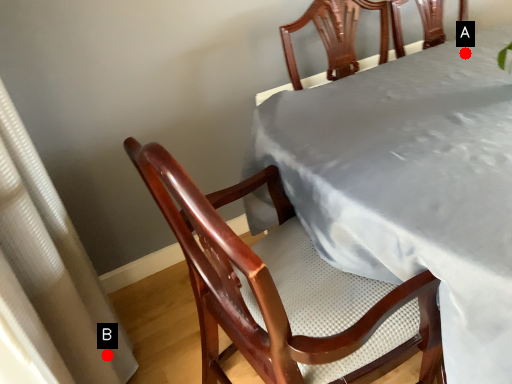
Question: Two points are circled on the image, labeled by A and B beside each circle. Which point is further to the camera?

Choices:
 (A) A is further
 (B) B is further

Answer: (A)